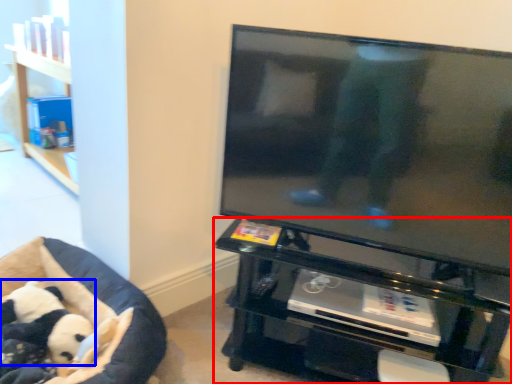
Question: Among these objects, which one is farthest to the camera, furniture (highlighted by a red box) or panda (highlighted by a blue box)?

Choices:
 (A) furniture
 (B) panda

Answer: (B)